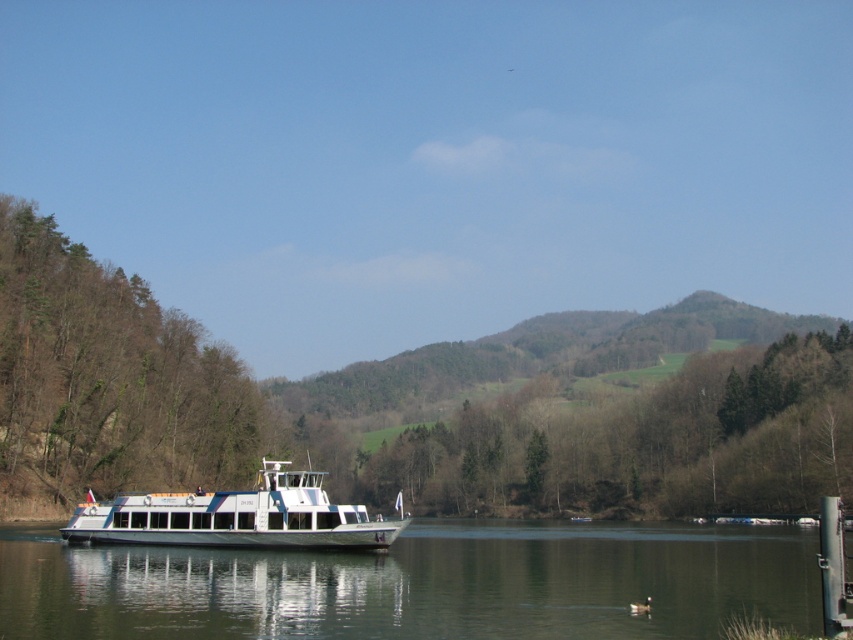
Question: Can you confirm if green leafy trees at center is positioned to the left of green leafy tree at left?

Choices:
 (A) no
 (B) yes

Answer: (A)

Question: Is green leafy trees at center closer to camera compared to green leafy tree at left?

Choices:
 (A) no
 (B) yes

Answer: (A)

Question: Can you confirm if green leafy tree at center is positioned to the left of green leafy trees at center?

Choices:
 (A) no
 (B) yes

Answer: (B)

Question: Which of the following is the farthest from the observer?

Choices:
 (A) (341, 515)
 (B) (717, 438)
 (C) (802, 573)
 (D) (18, 234)

Answer: (B)

Question: Which point is farther to the camera?

Choices:
 (A) (838, 388)
 (B) (120, 353)

Answer: (A)

Question: Based on their relative distances, which object is farther from the green leafy trees at center?

Choices:
 (A) green leafy tree at center
 (B) green leafy tree at left
 (C) white glossy boat at center
 (D) green reflective water at lower center

Answer: (C)